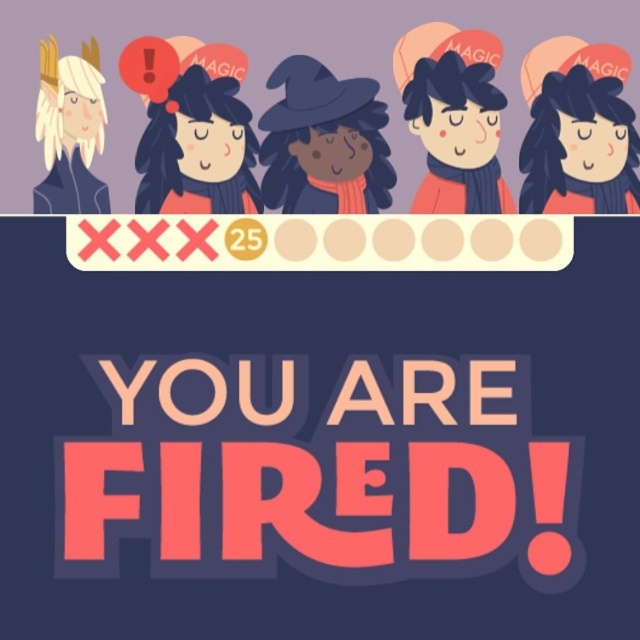
Between bold pink text at center and matte red hair at center, which one is positioned higher?

matte red hair at center is above.

Is point (157, 556) positioned behind point (225, 104)?

No, it is in front of (225, 104).

I want to click on bold pink text at center, so click(321, 474).

Who is more distant from viewer, (x=353, y=163) or (x=243, y=131)?

The point (x=353, y=163) is more distant.

At what (x,y) coordinates should I click in order to perform the action: click on matte witch hat at center. Please return your answer as a coordinate pair (x, y). The width and height of the screenshot is (640, 640). Looking at the image, I should click on (323, 141).

Which is in front, point (365, 212) or point (74, 179)?

Point (74, 179) is in front.

Is matte witch hat at center below smooth white hair at upper left?

Yes.

Is point (340, 160) positioned behind point (97, 64)?

Yes, it is behind point (97, 64).

Where is `matte witch hat at center`? This screenshot has width=640, height=640. matte witch hat at center is located at coordinates (323, 141).